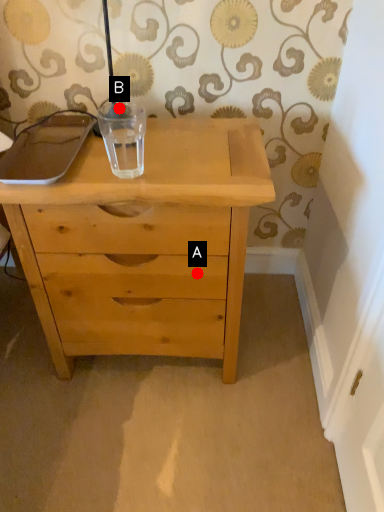
Question: Two points are circled on the image, labeled by A and B beside each circle. Which point is farther to the camera?

Choices:
 (A) A is further
 (B) B is further

Answer: (B)